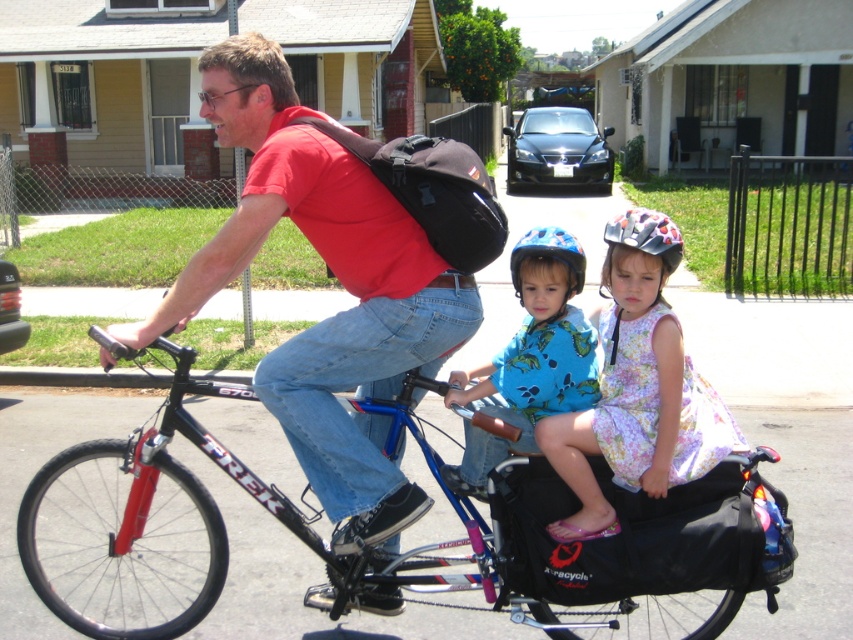
You are a safety inspector checking the helmets of the children on the bicycle. Which helmet, the multicolored plastic helmet at center or the blue matte helmet at center, is more likely to be a child size?

The multicolored plastic helmet at center has a smaller size compared to the blue matte helmet at center, so it is more likely to be a child size.

You are a photographer trying to capture both the multicolored plastic helmet at center and the blue matte helmet at center in a single frame. Which helmet should you adjust your camera angle to focus on first if you want to ensure both are visible?

The multicolored plastic helmet at center is to the right of the blue matte helmet at center. To capture both in a single frame, focus on the blue matte helmet at center first as it is on the left, allowing the camera to adjust to include the multicolored plastic helmet at center on the right side of the frame.

You are a photographer trying to capture a clear shot of the floral dress at center and the blue matte helmet at center. Which object should you zoom in on to ensure it takes up more space in your photo without moving the camera?

The floral dress at center has a larger width than the blue matte helmet at center, so zooming in on the floral dress at center will make it take up more space in the photo.